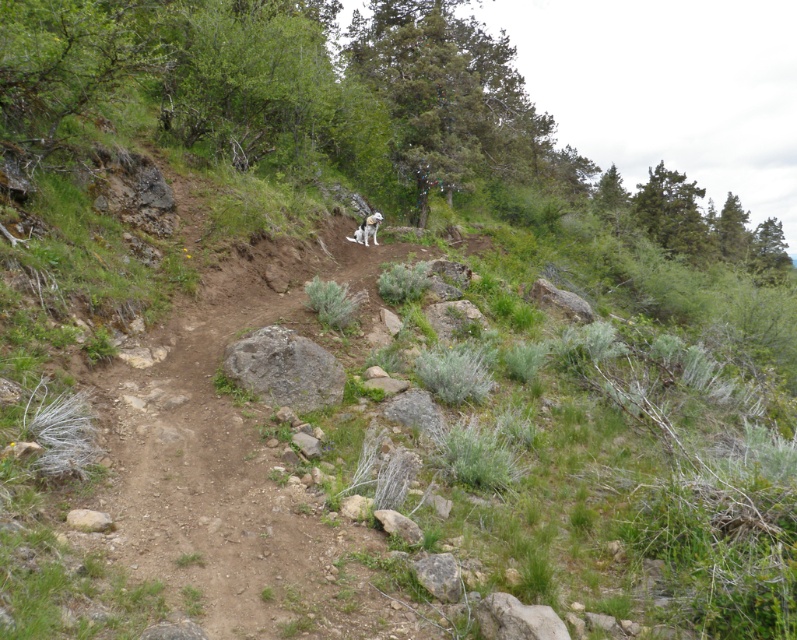
Which is above, dull brown dirt track at center or white fur dog at center?

white fur dog at center is above.

Does dull brown dirt track at center appear under white fur dog at center?

Correct, dull brown dirt track at center is located below white fur dog at center.

Measure the distance between dull brown dirt track at center and camera.

A distance of 19.13 feet exists between dull brown dirt track at center and camera.

At what (x,y) coordinates should I click in order to perform the action: click on dull brown dirt track at center. Please return your answer as a coordinate pair (x, y). The height and width of the screenshot is (640, 797). Looking at the image, I should click on (222, 474).

What do you see at coordinates (222, 474) in the screenshot? I see `dull brown dirt track at center` at bounding box center [222, 474].

Who is more forward, [152,387] or [287,392]?

Point [152,387] is in front.

At what (x,y) coordinates should I click in order to perform the action: click on dull brown dirt track at center. Please return your answer as a coordinate pair (x, y). Looking at the image, I should click on (222, 474).

What do you see at coordinates (285, 369) in the screenshot? The width and height of the screenshot is (797, 640). I see `gray rough rock at center` at bounding box center [285, 369].

Describe the element at coordinates (285, 369) in the screenshot. Image resolution: width=797 pixels, height=640 pixels. I see `gray rough rock at center` at that location.

The height and width of the screenshot is (640, 797). In order to click on gray rough rock at center in this screenshot , I will do `click(285, 369)`.